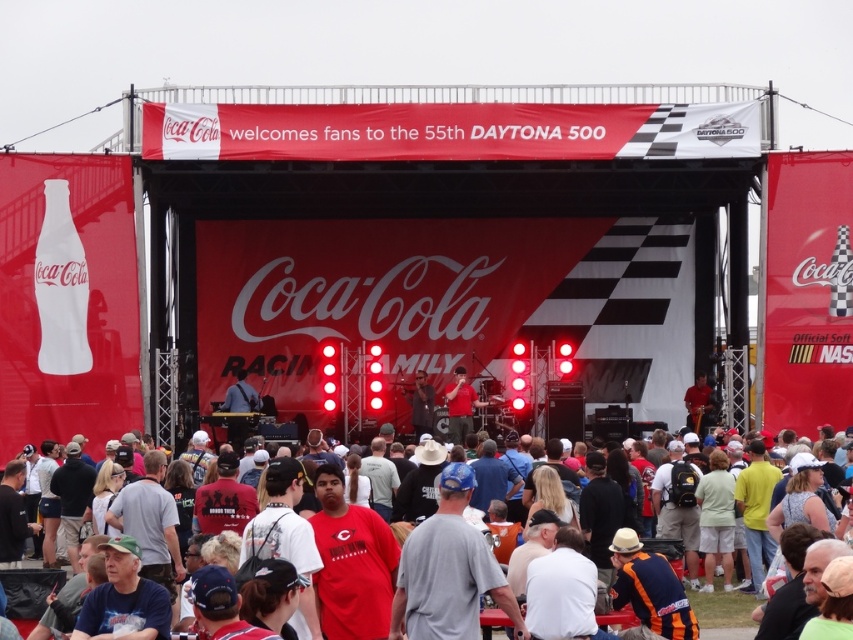
Question: From the image, what is the correct spatial relationship of white cotton t-shirts at lower center in relation to red matte shirt at center?

Choices:
 (A) below
 (B) above

Answer: (A)

Question: Among these objects, which one is nearest to the camera?

Choices:
 (A) red matte shirt at center
 (B) matte black microphone at center

Answer: (B)

Question: Which of the following is the farthest from the observer?

Choices:
 (A) (701, 620)
 (B) (424, 572)
 (C) (412, 417)

Answer: (C)

Question: Which object is closer to the camera taking this photo?

Choices:
 (A) white cotton t-shirts at lower center
 (B) gray fabric shirt at center
 (C) red matte shirt at center
 (D) matte black microphone at center

Answer: (B)

Question: Can you confirm if gray fabric shirt at center is positioned above white cotton t-shirts at lower center?

Choices:
 (A) no
 (B) yes

Answer: (B)

Question: Is gray fabric shirt at center closer to camera compared to red matte shirt at center?

Choices:
 (A) yes
 (B) no

Answer: (A)